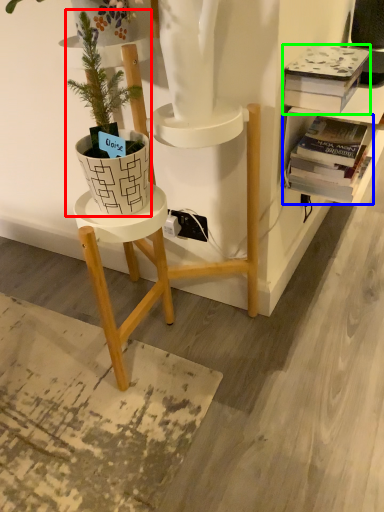
Question: Estimate the real-world distances between objects in this image. Which object is closer to houseplant (highlighted by a red box), book (highlighted by a blue box) or book (highlighted by a green box)?

Choices:
 (A) book
 (B) book

Answer: (B)